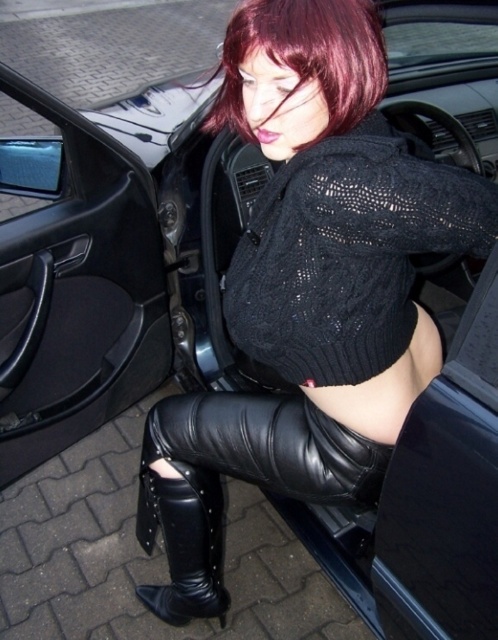
You are a fashion designer observing the person in the image. You need to determine if the distance between the black leather pants at lower center and the shiny burgundy hair at upper center is sufficient to accommodate a 30 inch long accessory. Can you confirm if the accessory will fit between them?

The distance between the black leather pants at lower center and the shiny burgundy hair at upper center is 28.71 inches, which is shorter than the 30 inch accessory. Therefore, the accessory will not fit between them.

You are standing at the center of the scene. Which direction should you move to reach the black leather car door at lower left?

You should move to the lower left direction to reach the black leather car door at lower left.

You are a fashion designer observing the scene. You need to decide which item is larger between the black leather car door at lower left and the black leather pants at lower center. Which one is bigger?

The black leather car door at lower left is bigger than the black leather pants at lower center according to the description.